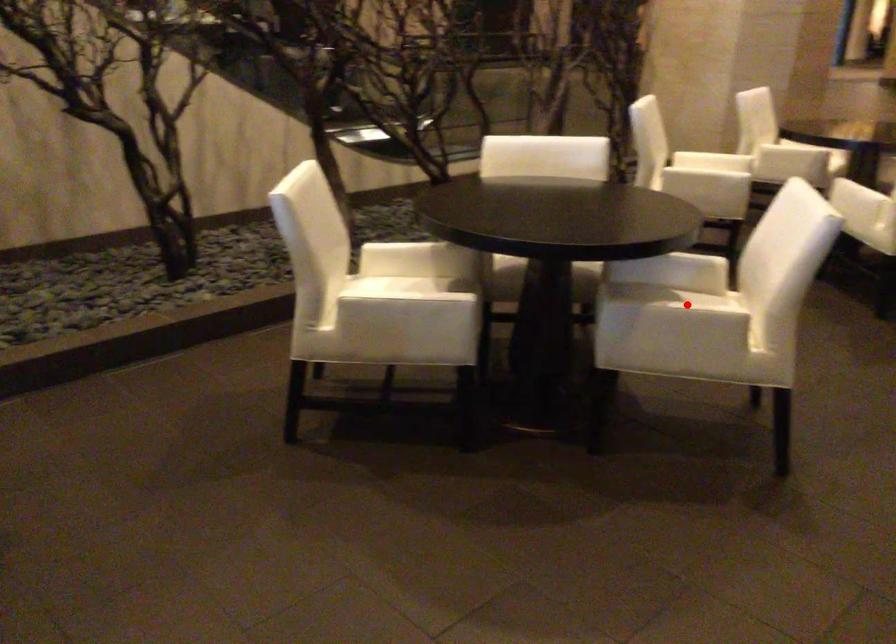
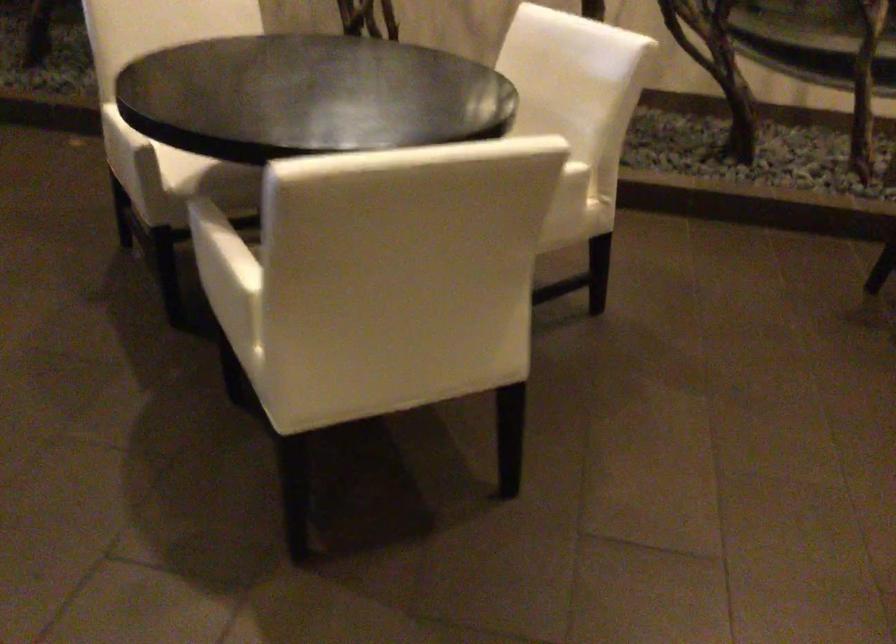
Question: I am providing you with two images of the same scene from different viewpoints. Image1 has a red point marked. In image2, the corresponding 3D location appears at what relative position? Reply with the corresponding letter.

Choices:
 (A) Closer
 (B) Farther

Answer: (A)